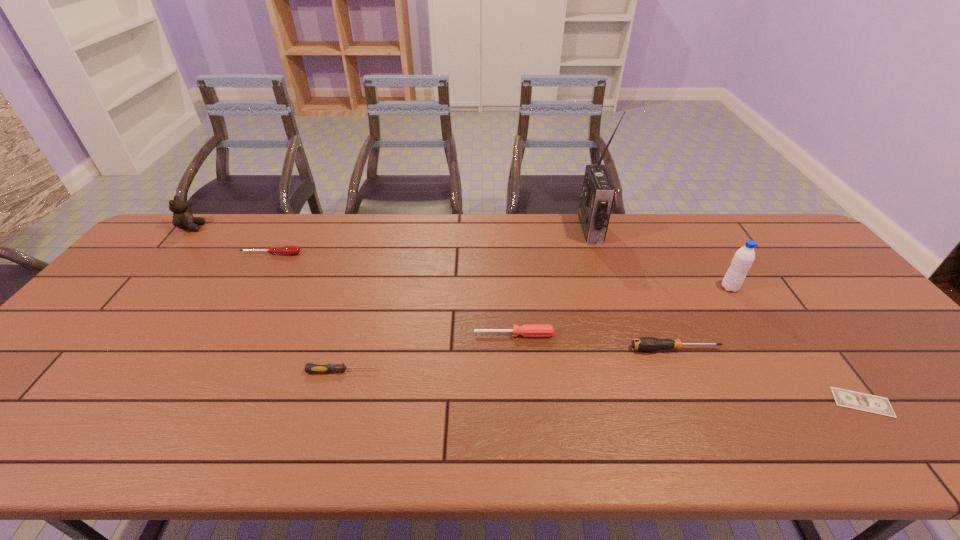
Point out which screwdriver is positioned as the second nearest to the farthest screwdriver. Please provide its 2D coordinates. Your answer should be formatted as a tuple, i.e. [(x, y)], where the tuple contains the x and y coordinates of a point satisfying the conditions above.

[(527, 330)]

This screenshot has width=960, height=540. In order to click on free space that satisfies the following two spatial constraints: 1. on the front side of the farthest screwdriver; 2. on the left side of the seventh shortest object in this screenshot , I will do `click(252, 288)`.

This screenshot has height=540, width=960. In order to click on free spot that satisfies the following two spatial constraints: 1. insert the nearest object into a screw head; 2. on the right side of the seventh farthest object in this screenshot , I will do `click(333, 402)`.

Locate an element on the screen. This screenshot has width=960, height=540. blank space that satisfies the following two spatial constraints: 1. on the face of the third farthest screwdriver; 2. on the right side of the sixth shortest object is located at coordinates (88, 349).

Locate an element on the screen. The width and height of the screenshot is (960, 540). vacant area that satisfies the following two spatial constraints: 1. insert the shortest screwdriver into a screw head; 2. on the right side of the nearest object is located at coordinates (333, 402).

Identify the location of vacant space that satisfies the following two spatial constraints: 1. on the face of the third tallest object; 2. on the right side of the seventh object from left to right. (141, 288).

Where is `free space that satisfies the following two spatial constraints: 1. on the face of the second farthest screwdriver; 2. on the left side of the third tallest object`? The image size is (960, 540). free space that satisfies the following two spatial constraints: 1. on the face of the second farthest screwdriver; 2. on the left side of the third tallest object is located at coordinates (101, 334).